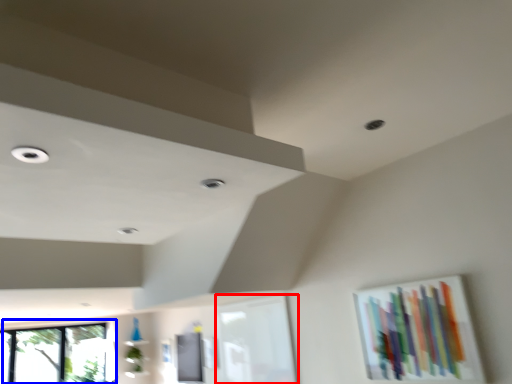
Question: Which point is closer to the camera, window frame (highlighted by a red box) or window (highlighted by a blue box)?

Choices:
 (A) window frame
 (B) window

Answer: (A)